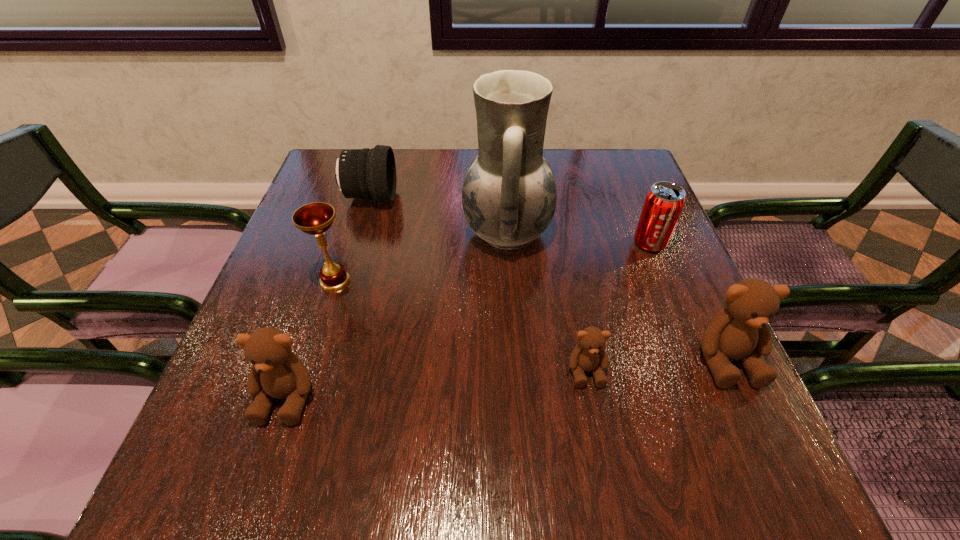
At what (x,y) coordinates should I click in order to perform the action: click on location for an additional teddy_bear to make spacing equal. Please return your answer as a coordinate pair (x, y). The width and height of the screenshot is (960, 540). Looking at the image, I should click on (440, 383).